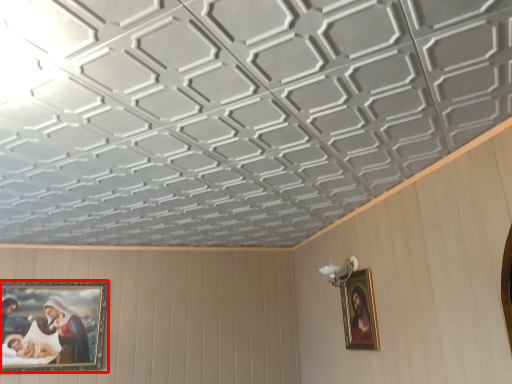
Question: Observing the image, what is the correct spatial positioning of picture frame (annotated by the red box) in reference to picture frame?

Choices:
 (A) right
 (B) left

Answer: (B)